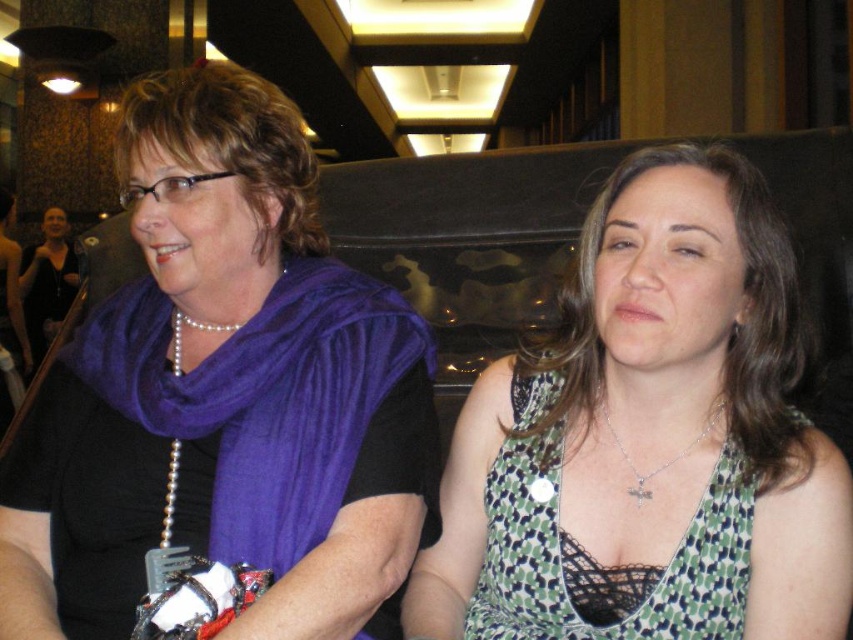
You are a fashion designer observing two items in the image. The green dotted fabric dress at center and the silver metallic necklace at center. Which item is positioned higher on the person?

The green dotted fabric dress at center is much taller as silver metallic necklace at center, so the green dotted fabric dress at center is positioned higher on the person.

You are a photographer at a social event. You want to capture a photo of the purple scarf at left and the green dotted fabric dress at center without any overlap between them. Given that your camera has a minimum focus distance of 12 inches, can you position yourself to take this photo?

The purple scarf at left is 12.29 inches from the green dotted fabric dress at center. Since the distance between them is greater than the camera minimum focus distance of 12 inches, you can position yourself to take the photo without overlap.

You are standing at the camera position and want to know how far the point at coordinates (599, 330) is from you. Can you determine the distance?

The distance between the point at coordinates (599, 330) and the camera is 3.30 feet.